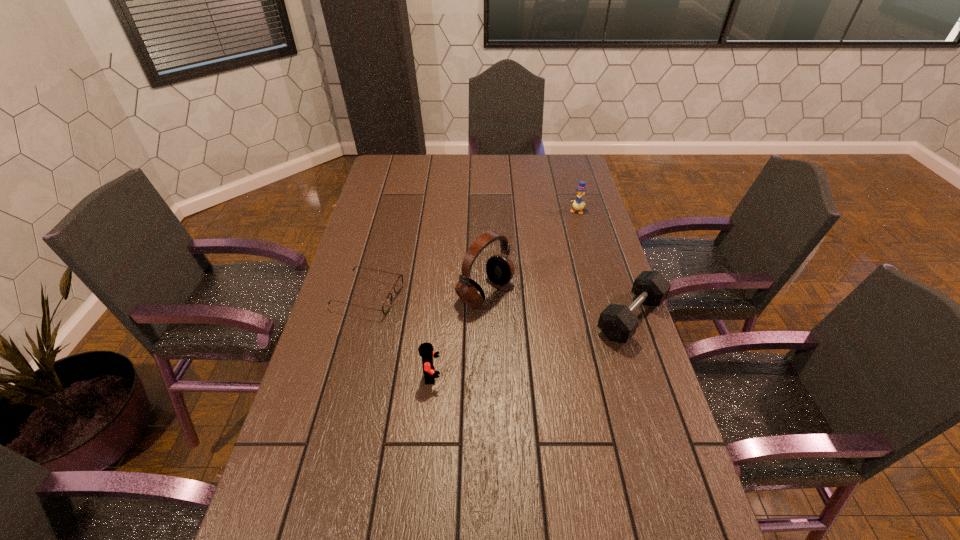
This screenshot has width=960, height=540. I want to click on Lego, so click(426, 349).

You are a GUI agent. You are given a task and a screenshot of the screen. Output one action in this format:
    pyautogui.click(x=<x>, y=<y>)
    Task: Click on the second object from left to right
    
    Given the screenshot: What is the action you would take?
    pyautogui.click(x=426, y=349)

Find the location of a particular element. This screenshot has height=540, width=960. dumbbell is located at coordinates (618, 323).

Where is `the leftmost object`? Image resolution: width=960 pixels, height=540 pixels. the leftmost object is located at coordinates (398, 285).

Where is `the shortest object`? the shortest object is located at coordinates (398, 285).

Locate an element on the screen. This screenshot has width=960, height=540. the farthest object is located at coordinates (578, 204).

Image resolution: width=960 pixels, height=540 pixels. In order to click on the third object from right to left in this screenshot , I will do `click(500, 269)`.

Where is `the tallest object`? The width and height of the screenshot is (960, 540). the tallest object is located at coordinates (500, 269).

This screenshot has width=960, height=540. What are the coordinates of `vacant space located on the front-facing side of the nearest object` in the screenshot? It's located at (553, 376).

This screenshot has height=540, width=960. I want to click on vacant space situated on the left of the fourth tallest object, so click(551, 318).